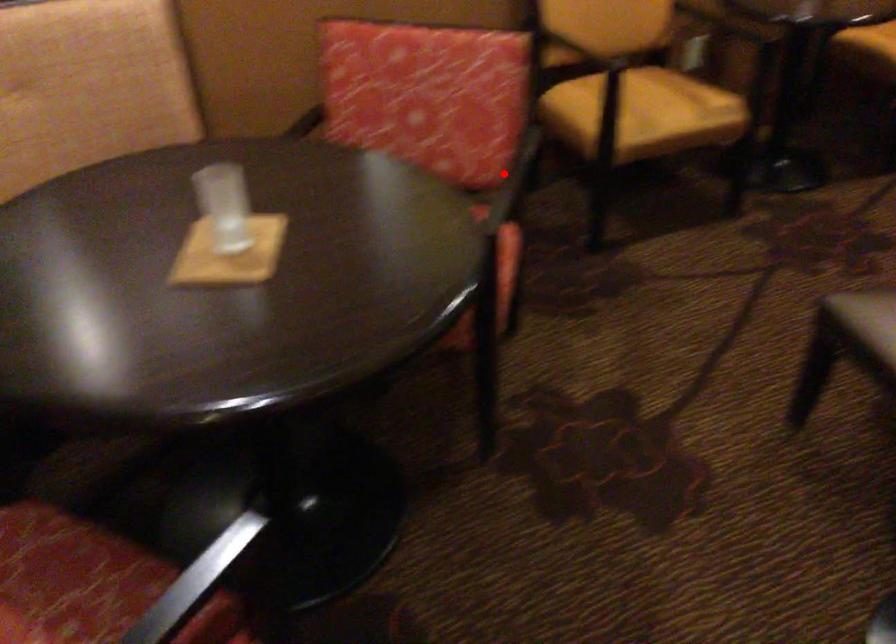
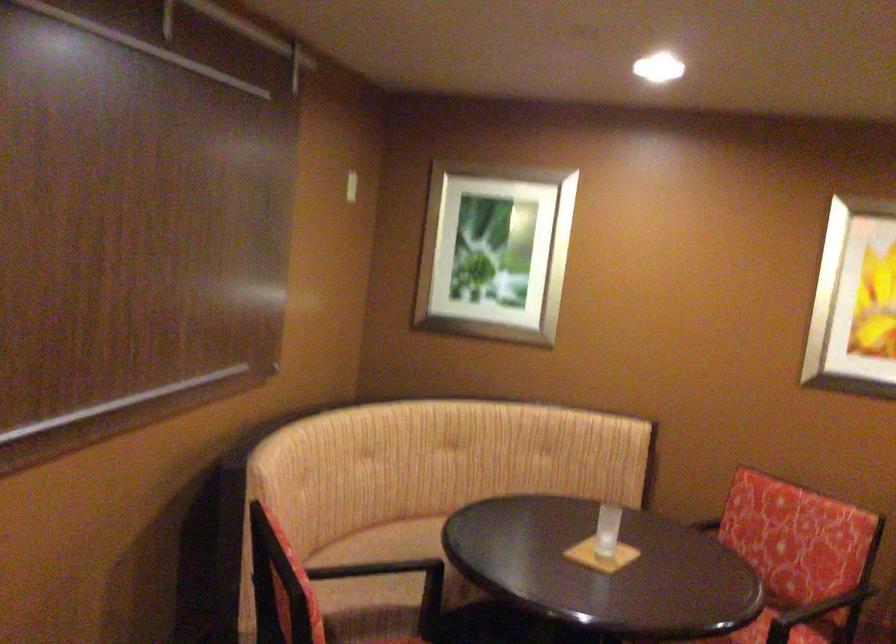
Locate, in the second image, the point that corresponds to the highlighted location in the first image.

(820, 614)